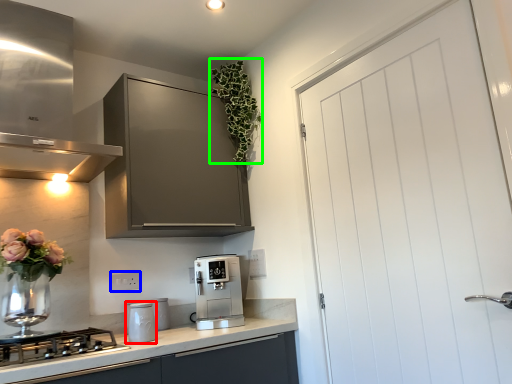
Question: Estimate the real-world distances between objects in this image. Which object is farther from kitchen appliance (highlighted by a red box), electric outlet (highlighted by a blue box) or floral arrangement (highlighted by a green box)?

Choices:
 (A) electric outlet
 (B) floral arrangement

Answer: (B)